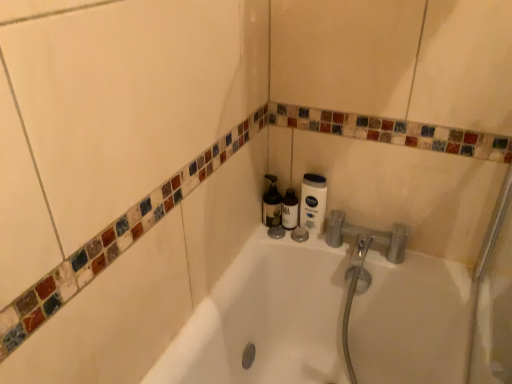
Question: Could you tell me if matte black bottle at center is facing white matte lotion at upper right?

Choices:
 (A) yes
 (B) no

Answer: (B)

Question: Does matte black bottle at center have a greater width compared to white matte lotion at upper right?

Choices:
 (A) yes
 (B) no

Answer: (A)

Question: Is matte black bottle at center located outside white matte lotion at upper right?

Choices:
 (A) yes
 (B) no

Answer: (A)

Question: Does matte black bottle at center contain white matte lotion at upper right?

Choices:
 (A) yes
 (B) no

Answer: (B)

Question: Considering the relative positions of matte black bottle at center and white matte lotion at upper right in the image provided, is matte black bottle at center in front of white matte lotion at upper right?

Choices:
 (A) no
 (B) yes

Answer: (A)

Question: Considering the positions of matte black bottle at center and translucent plastic bottle at center in the image, is matte black bottle at center wider or thinner than translucent plastic bottle at center?

Choices:
 (A) wide
 (B) thin

Answer: (B)

Question: In the image, is matte black bottle at center on the left side or the right side of translucent plastic bottle at center?

Choices:
 (A) left
 (B) right

Answer: (B)

Question: Looking at the image, does matte black bottle at center seem bigger or smaller compared to translucent plastic bottle at center?

Choices:
 (A) small
 (B) big

Answer: (A)

Question: From their relative heights in the image, would you say matte black bottle at center is taller or shorter than translucent plastic bottle at center?

Choices:
 (A) tall
 (B) short

Answer: (B)

Question: Considering the positions of point (315, 193) and point (271, 208), is point (315, 193) closer or farther from the camera than point (271, 208)?

Choices:
 (A) closer
 (B) farther

Answer: (A)

Question: Based on their positions, is white matte lotion at upper right located to the left or right of translucent plastic bottle at center?

Choices:
 (A) right
 (B) left

Answer: (A)

Question: Is white matte lotion at upper right inside or outside of translucent plastic bottle at center?

Choices:
 (A) outside
 (B) inside

Answer: (A)

Question: Is white matte lotion at upper right in front of or behind translucent plastic bottle at center in the image?

Choices:
 (A) behind
 (B) front

Answer: (B)

Question: In the image, is translucent plastic bottle at center positioned in front of or behind matte black bottle at center?

Choices:
 (A) front
 (B) behind

Answer: (A)

Question: From the image's perspective, is translucent plastic bottle at center located above or below matte black bottle at center?

Choices:
 (A) above
 (B) below

Answer: (A)